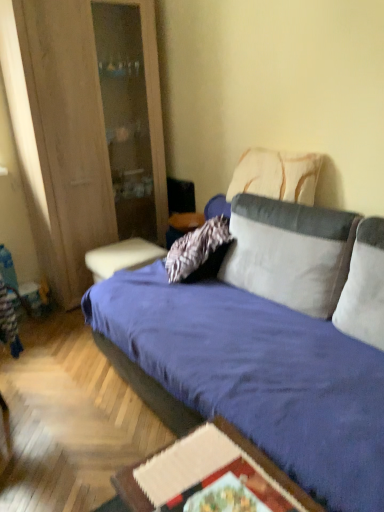
Question: Is matte blue table at center, which ranks as the first table in back-to-front order, oriented towards white soft pillow at right, the 3th pillow positioned from the back?

Choices:
 (A) no
 (B) yes

Answer: (A)

Question: Does matte blue table at center, which ranks as the first table in back-to-front order, have a larger size compared to white soft pillow at right, which is the first pillow from front to back?

Choices:
 (A) yes
 (B) no

Answer: (A)

Question: Is matte blue table at center, positioned as the 2th table in right-to-left order, behind white soft pillow at right, which is the first pillow from front to back?

Choices:
 (A) no
 (B) yes

Answer: (B)

Question: Considering the relative positions of matte blue table at center, the 1th table when ordered from top to bottom, and white soft pillow at right, the 3th pillow positioned from the back, in the image provided, is matte blue table at center, the 1th table when ordered from top to bottom, to the right of white soft pillow at right, the 3th pillow positioned from the back, from the viewer's perspective?

Choices:
 (A) no
 (B) yes

Answer: (A)

Question: Is matte blue table at center, positioned as the 2th table in right-to-left order, far away from white soft pillow at right, which is the first pillow from front to back?

Choices:
 (A) no
 (B) yes

Answer: (B)

Question: Is point (104, 252) closer or farther from the camera than point (354, 480)?

Choices:
 (A) farther
 (B) closer

Answer: (A)

Question: Is matte blue table at center, the second table viewed from the front, inside the boundaries of velvet blue studio couch at center, or outside?

Choices:
 (A) inside
 (B) outside

Answer: (B)

Question: Is matte blue table at center, the second table when ordered from bottom to top, to the left or to the right of velvet blue studio couch at center in the image?

Choices:
 (A) left
 (B) right

Answer: (A)

Question: Considering their positions, is matte blue table at center, the second table viewed from the front, located in front of or behind velvet blue studio couch at center?

Choices:
 (A) front
 (B) behind

Answer: (B)

Question: Relative to matte blue table at center, the second table viewed from the front, is wooden cabinet at left in front or behind?

Choices:
 (A) behind
 (B) front

Answer: (B)

Question: From a real-world perspective, is wooden cabinet at left physically located above or below matte blue table at center, the 1th table when ordered from top to bottom?

Choices:
 (A) above
 (B) below

Answer: (A)

Question: From the image's perspective, relative to matte blue table at center, positioned as the 2th table in right-to-left order, is wooden cabinet at left above or below?

Choices:
 (A) above
 (B) below

Answer: (A)

Question: From their relative heights in the image, would you say wooden cabinet at left is taller or shorter than matte blue table at center, the 1th table when ordered from top to bottom?

Choices:
 (A) short
 (B) tall

Answer: (B)

Question: Is white textured pillow at upper right, the 1th pillow viewed from the back, in front of or behind wooden cabinet at left in the image?

Choices:
 (A) behind
 (B) front

Answer: (B)

Question: Considering the positions of white textured pillow at upper right, the 1th pillow viewed from the back, and wooden cabinet at left in the image, is white textured pillow at upper right, the 1th pillow viewed from the back, taller or shorter than wooden cabinet at left?

Choices:
 (A) short
 (B) tall

Answer: (A)